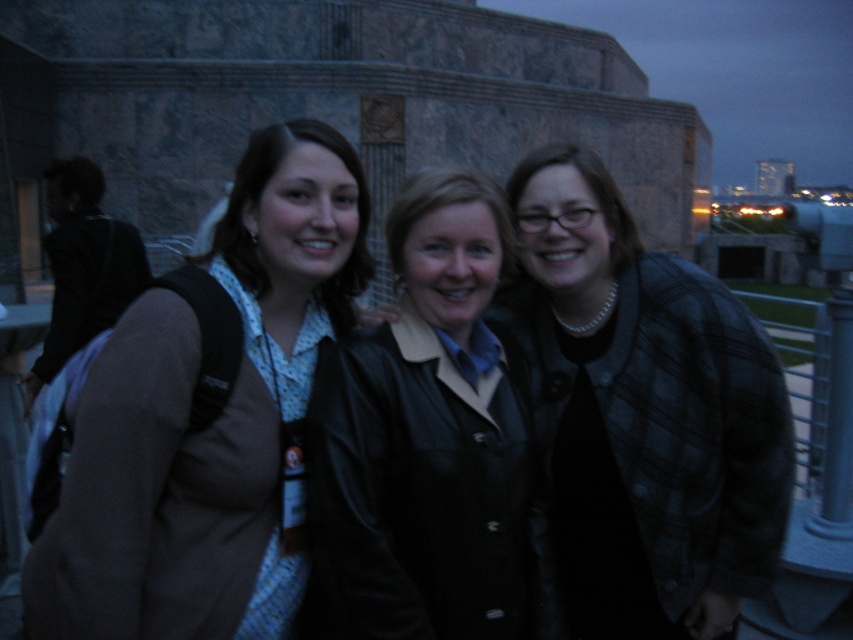
You are taking a photo of three friends standing near a stone monument. You want to focus on the person at point (669, 513) and the person at point (514, 406). Which of these two points is closer to the camera?

Point (669, 513) is closer to the camera than point (514, 406).

You are a photographer trying to capture a group photo of the three individuals. The camera you are using has a limited depth of field, so you can only focus on one jacket at a time. If you want to ensure that both the brown leather jacket at center and the black leather jacket at center are in focus, which jacket should you focus on based on their widths?

The brown leather jacket at center is wider than the black leather jacket at center. To ensure both are in focus, you should focus on the brown leather jacket at center since it is larger and requires a deeper depth of field.

You are a photographer trying to capture a clear photo of the brown leather jacket at center and the black leather jacket at center. Which jacket should you focus on to ensure it appears sharp in the photo?

The brown leather jacket at center is in front of the black leather jacket at center, so focusing on the brown leather jacket at center will ensure it appears sharp while the black one may be slightly blurred in the background.